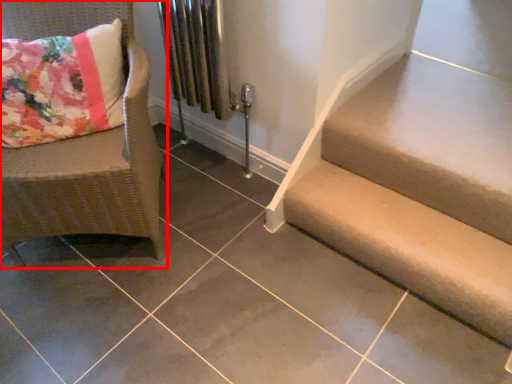
Question: Observing the image, what is the correct spatial positioning of chair (annotated by the red box) in reference to stairs?

Choices:
 (A) left
 (B) right

Answer: (A)